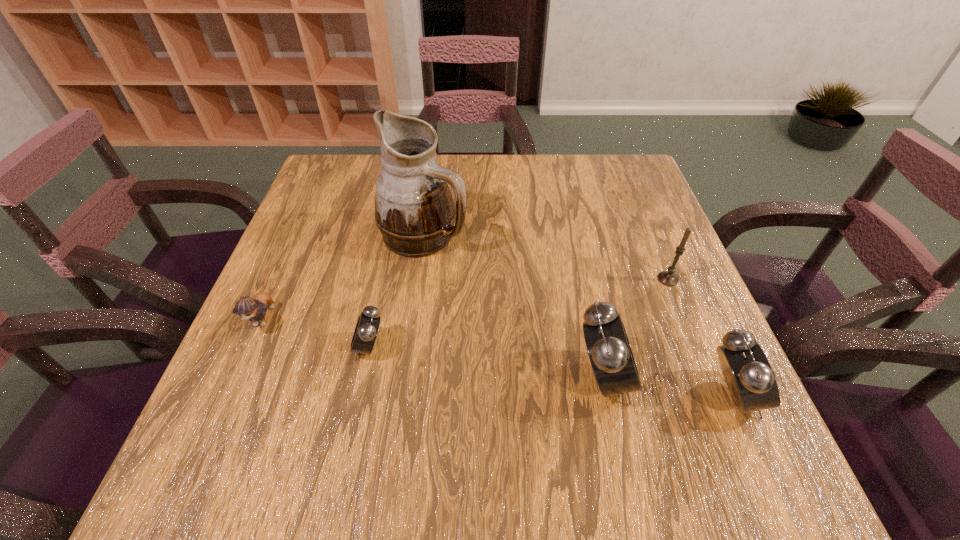
Please point a location where one more alarm_clock can be added evenly. Please provide its 2D coordinates. Your answer should be formatted as a tuple, i.e. [(x, y)], where the tuple contains the x and y coordinates of a point satisfying the conditions above.

[(483, 362)]